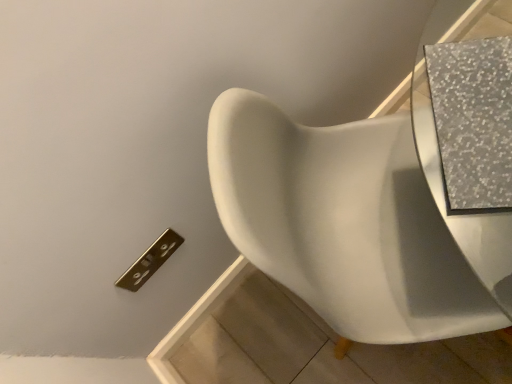
Question: Should I look upward or downward to see white glossy toilet at center?

Choices:
 (A) down
 (B) up

Answer: (A)